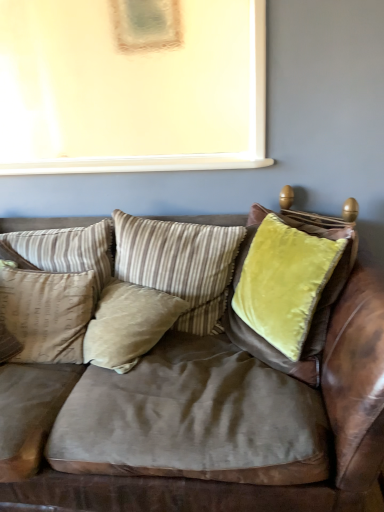
Describe the element at coordinates (67, 249) in the screenshot. Image resolution: width=384 pixels, height=512 pixels. I see `beige striped pillow at center, acting as the third pillow starting from the right` at that location.

At what (x,y) coordinates should I click in order to perform the action: click on striped fabric pillow at center, positioned as the fourth pillow in left-to-right order. Please return your answer as a coordinate pair (x, y). The height and width of the screenshot is (512, 384). Looking at the image, I should click on (179, 263).

What is the approximate height of beige fabric pillow at left, acting as the 4th pillow starting from the right?

beige fabric pillow at left, acting as the 4th pillow starting from the right, is 16.88 inches tall.

Find the location of a particular element. velvet brown couch at center is located at coordinates (186, 401).

Does beige fabric pillow at left, acting as the 4th pillow starting from the right, have a lesser height compared to striped fabric pillow at center, positioned as the 1th pillow in right-to-left order?

Yes, beige fabric pillow at left, acting as the 4th pillow starting from the right, is shorter than striped fabric pillow at center, positioned as the 1th pillow in right-to-left order.

Can we say beige fabric pillow at left, acting as the 4th pillow starting from the right, lies outside striped fabric pillow at center, positioned as the fourth pillow in left-to-right order?

Yes, beige fabric pillow at left, acting as the 4th pillow starting from the right, is outside of striped fabric pillow at center, positioned as the fourth pillow in left-to-right order.

Is beige fabric pillow at left, arranged as the 1th pillow when viewed from the left, turned away from striped fabric pillow at center, positioned as the 1th pillow in right-to-left order?

That's not correct — beige fabric pillow at left, arranged as the 1th pillow when viewed from the left, is not looking away from striped fabric pillow at center, positioned as the 1th pillow in right-to-left order.

Starting from the beige fabric pillow at left, arranged as the 1th pillow when viewed from the left, which pillow is the 1st one behind? Please provide its 2D coordinates.

[(179, 263)]

Is velvet brown couch at center looking in the opposite direction of beige velvet pillow at center, placed as the second pillow when sorted from right to left?

Yes, velvet brown couch at center is facing away from beige velvet pillow at center, placed as the second pillow when sorted from right to left.

Considering the relative sizes of velvet brown couch at center and beige velvet pillow at center, acting as the 3th pillow starting from the left, in the image provided, is velvet brown couch at center taller than beige velvet pillow at center, acting as the 3th pillow starting from the left,?

Yes, velvet brown couch at center is taller than beige velvet pillow at center, acting as the 3th pillow starting from the left.

Considering the relative positions of velvet brown couch at center and beige velvet pillow at center, placed as the second pillow when sorted from right to left, in the image provided, is velvet brown couch at center in front of beige velvet pillow at center, placed as the second pillow when sorted from right to left,?

Yes, velvet brown couch at center is closer to the camera.

From the image's perspective, relative to beige velvet pillow at center, placed as the second pillow when sorted from right to left, is velvet brown couch at center above or below?

Clearly, from the image's perspective, velvet brown couch at center is below beige velvet pillow at center, placed as the second pillow when sorted from right to left.

Looking at their sizes, would you say striped fabric pillow at center, positioned as the 1th pillow in right-to-left order, is wider or thinner than beige velvet pillow at center, placed as the second pillow when sorted from right to left?

Considering their sizes, striped fabric pillow at center, positioned as the 1th pillow in right-to-left order, looks slimmer than beige velvet pillow at center, placed as the second pillow when sorted from right to left.

Is the position of striped fabric pillow at center, positioned as the fourth pillow in left-to-right order, less distant than that of beige velvet pillow at center, acting as the 3th pillow starting from the left?

No, striped fabric pillow at center, positioned as the fourth pillow in left-to-right order, is further to the viewer.

Are striped fabric pillow at center, positioned as the 1th pillow in right-to-left order, and beige velvet pillow at center, acting as the 3th pillow starting from the left, beside each other?

No, striped fabric pillow at center, positioned as the 1th pillow in right-to-left order, is not in contact with beige velvet pillow at center, acting as the 3th pillow starting from the left.

Can you confirm if striped fabric pillow at center, positioned as the fourth pillow in left-to-right order, is smaller than beige velvet pillow at center, placed as the second pillow when sorted from right to left?

Incorrect, striped fabric pillow at center, positioned as the fourth pillow in left-to-right order, is not smaller in size than beige velvet pillow at center, placed as the second pillow when sorted from right to left.

Is striped fabric pillow at center, positioned as the 1th pillow in right-to-left order, oriented away from beige striped pillow at center, marked as the second pillow in a left-to-right arrangement?

No, striped fabric pillow at center, positioned as the 1th pillow in right-to-left order, is not facing the opposite direction of beige striped pillow at center, marked as the second pillow in a left-to-right arrangement.

Are striped fabric pillow at center, positioned as the fourth pillow in left-to-right order, and beige striped pillow at center, acting as the third pillow starting from the right, located far from each other?

No, striped fabric pillow at center, positioned as the fourth pillow in left-to-right order, is not far from beige striped pillow at center, acting as the third pillow starting from the right.

From the image's perspective, is striped fabric pillow at center, positioned as the 1th pillow in right-to-left order, under beige striped pillow at center, marked as the second pillow in a left-to-right arrangement?

Yes, from the image's perspective, striped fabric pillow at center, positioned as the 1th pillow in right-to-left order, is below beige striped pillow at center, marked as the second pillow in a left-to-right arrangement.

Considering the relative positions of striped fabric pillow at center, positioned as the fourth pillow in left-to-right order, and beige striped pillow at center, acting as the third pillow starting from the right, in the image provided, is striped fabric pillow at center, positioned as the fourth pillow in left-to-right order, in front of beige striped pillow at center, acting as the third pillow starting from the right,?

Yes, striped fabric pillow at center, positioned as the fourth pillow in left-to-right order, is in front of beige striped pillow at center, acting as the third pillow starting from the right.

Is beige fabric pillow at left, acting as the 4th pillow starting from the right, to the left of velvet brown couch at center from the viewer's perspective?

Correct, you'll find beige fabric pillow at left, acting as the 4th pillow starting from the right, to the left of velvet brown couch at center.

From the image's perspective, which one is positioned lower, beige fabric pillow at left, arranged as the 1th pillow when viewed from the left, or velvet brown couch at center?

velvet brown couch at center appears lower in the image.

Looking at this image, from a real-world perspective, is beige striped pillow at center, marked as the second pillow in a left-to-right arrangement, on top of velvet brown couch at center?

Yes.

Which object is further away from the camera taking this photo, beige striped pillow at center, acting as the third pillow starting from the right, or velvet brown couch at center?

beige striped pillow at center, acting as the third pillow starting from the right, is behind.

Do you think beige striped pillow at center, marked as the second pillow in a left-to-right arrangement, is within velvet brown couch at center, or outside of it?

beige striped pillow at center, marked as the second pillow in a left-to-right arrangement, is spatially positioned inside velvet brown couch at center.

Is beige striped pillow at center, acting as the third pillow starting from the right, positioned far away from velvet brown couch at center?

No, beige striped pillow at center, acting as the third pillow starting from the right, is not far from velvet brown couch at center.

From the image's perspective, would you say beige striped pillow at center, acting as the third pillow starting from the right, is positioned over striped fabric pillow at center, positioned as the 1th pillow in right-to-left order?

Indeed, from the image's perspective, beige striped pillow at center, acting as the third pillow starting from the right, is shown above striped fabric pillow at center, positioned as the 1th pillow in right-to-left order.

Is the depth of beige striped pillow at center, marked as the second pillow in a left-to-right arrangement, greater than that of striped fabric pillow at center, positioned as the fourth pillow in left-to-right order?

That is True.

Which is nearer, (77, 251) or (213, 285)?

The point (213, 285) is more forward.

You are a GUI agent. You are given a task and a screenshot of the screen. Output one action in this format:
    pyautogui.click(x=<x>, y=<y>)
    Task: Click on the 1st pillow below the beige striped pillow at center, acting as the third pillow starting from the right (from a real-world perspective)
    The height and width of the screenshot is (512, 384).
    Given the screenshot: What is the action you would take?
    pyautogui.click(x=179, y=263)

Locate an element on the screen. the 1st pillow in front of the striped fabric pillow at center, positioned as the 1th pillow in right-to-left order is located at coordinates (47, 313).

Image resolution: width=384 pixels, height=512 pixels. What are the coordinates of `pillow that is the 1st object above the velvet brown couch at center (from a real-world perspective)` in the screenshot? It's located at (128, 324).

Estimate the real-world distances between objects in this image. Which object is further from beige striped pillow at center, marked as the second pillow in a left-to-right arrangement, striped fabric pillow at center, positioned as the 1th pillow in right-to-left order, or velvet brown couch at center?

Based on the image, velvet brown couch at center appears to be further to beige striped pillow at center, marked as the second pillow in a left-to-right arrangement.

Based on their spatial positions, is beige striped pillow at center, acting as the third pillow starting from the right, or beige velvet pillow at center, acting as the 3th pillow starting from the left, closer to velvet brown couch at center?

beige velvet pillow at center, acting as the 3th pillow starting from the left.

Looking at the image, which one is located further to striped fabric pillow at center, positioned as the 1th pillow in right-to-left order, velvet brown couch at center or beige velvet pillow at center, placed as the second pillow when sorted from right to left?

The object further to striped fabric pillow at center, positioned as the 1th pillow in right-to-left order, is velvet brown couch at center.

Considering their positions, is velvet brown couch at center positioned closer to beige striped pillow at center, acting as the third pillow starting from the right, than beige velvet pillow at center, placed as the second pillow when sorted from right to left?

beige velvet pillow at center, placed as the second pillow when sorted from right to left, lies closer to beige striped pillow at center, acting as the third pillow starting from the right, than the other object.

When comparing their distances from beige fabric pillow at left, arranged as the 1th pillow when viewed from the left, does beige striped pillow at center, acting as the third pillow starting from the right, or velvet brown couch at center seem closer?

beige striped pillow at center, acting as the third pillow starting from the right.

When comparing their distances from velvet brown couch at center, does beige velvet pillow at center, acting as the 3th pillow starting from the left, or beige fabric pillow at left, acting as the 4th pillow starting from the right, seem further?

Based on the image, beige fabric pillow at left, acting as the 4th pillow starting from the right, appears to be further to velvet brown couch at center.

Considering their positions, is beige striped pillow at center, marked as the second pillow in a left-to-right arrangement, positioned further to velvet brown couch at center than striped fabric pillow at center, positioned as the fourth pillow in left-to-right order?

Based on the image, beige striped pillow at center, marked as the second pillow in a left-to-right arrangement, appears to be further to velvet brown couch at center.

Estimate the real-world distances between objects in this image. Which object is further from beige velvet pillow at center, placed as the second pillow when sorted from right to left, beige striped pillow at center, acting as the third pillow starting from the right, or beige fabric pillow at left, arranged as the 1th pillow when viewed from the left?

beige striped pillow at center, acting as the third pillow starting from the right, is positioned further to the anchor beige velvet pillow at center, placed as the second pillow when sorted from right to left.

Where is `pillow between beige striped pillow at center, marked as the second pillow in a left-to-right arrangement, and striped fabric pillow at center, positioned as the fourth pillow in left-to-right order`? The image size is (384, 512). pillow between beige striped pillow at center, marked as the second pillow in a left-to-right arrangement, and striped fabric pillow at center, positioned as the fourth pillow in left-to-right order is located at coordinates (128, 324).

Locate an element on the screen. pillow between velvet brown couch at center and beige fabric pillow at left, acting as the 4th pillow starting from the right, from front to back is located at coordinates (128, 324).

I want to click on pillow between beige fabric pillow at left, acting as the 4th pillow starting from the right, and beige velvet pillow at center, acting as the 3th pillow starting from the left, in the horizontal direction, so click(67, 249).